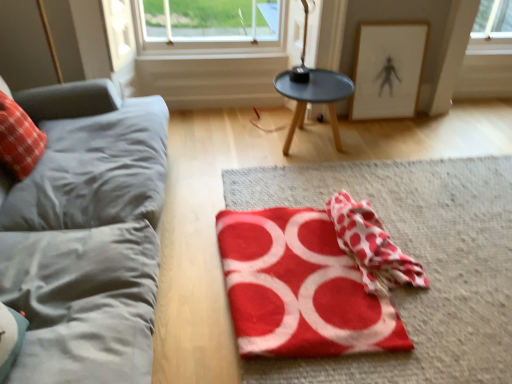
Find the location of a particular element. The image size is (512, 384). unoccupied region to the right of red felt yoga mat at center is located at coordinates (449, 269).